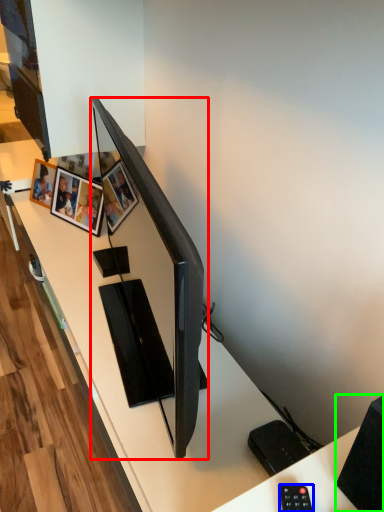
Question: Considering the real-world distances, which object is farthest from television (highlighted by a red box)? control (highlighted by a blue box) or speaker (highlighted by a green box)?

Choices:
 (A) control
 (B) speaker

Answer: (A)